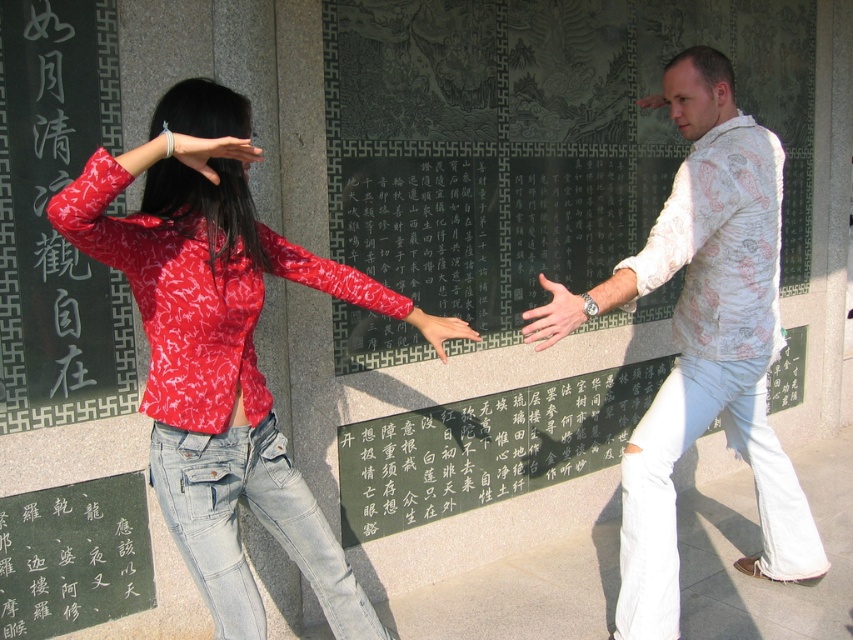
Question: Among these objects, which one is farthest from the camera?

Choices:
 (A) white textured shirt at center
 (B) denim at right
 (C) denim jeans at center
 (D) matte black hand at center

Answer: (B)

Question: Where is denim at right located in relation to matte white hand at center in the image?

Choices:
 (A) left
 (B) right

Answer: (B)

Question: Can you confirm if matte red blouse at center is positioned to the left of white textured shirt at center?

Choices:
 (A) no
 (B) yes

Answer: (B)

Question: Among these objects, which one is nearest to the camera?

Choices:
 (A) matte black hand at center
 (B) matte red blouse at center
 (C) white printed shirt at right
 (D) denim at right

Answer: (B)

Question: Which point is farther to the camera?

Choices:
 (A) smooth red fabric hand at center
 (B) matte white hand at center
 (C) white printed shirt at right

Answer: (C)

Question: Can you confirm if matte red blouse at center is smaller than white printed shirt at right?

Choices:
 (A) no
 (B) yes

Answer: (A)